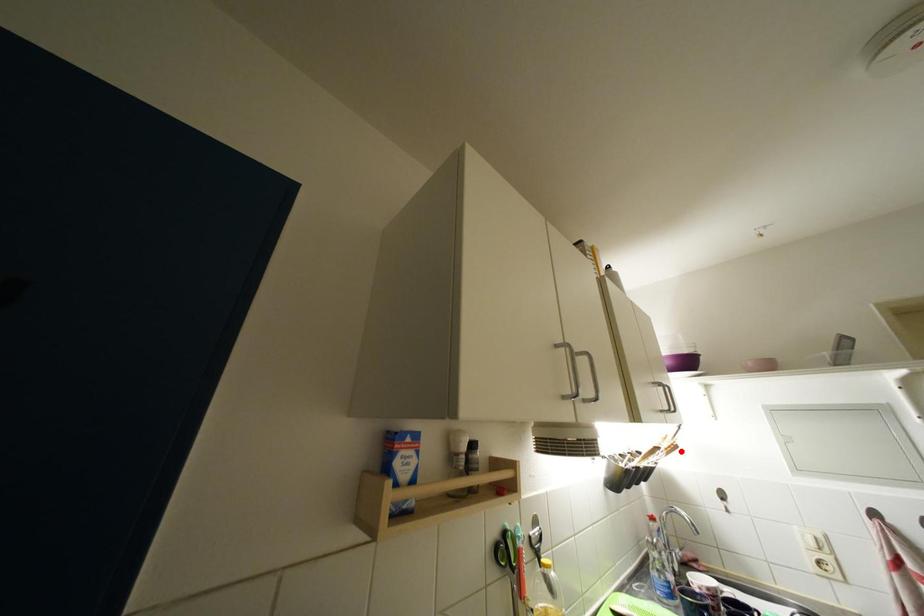
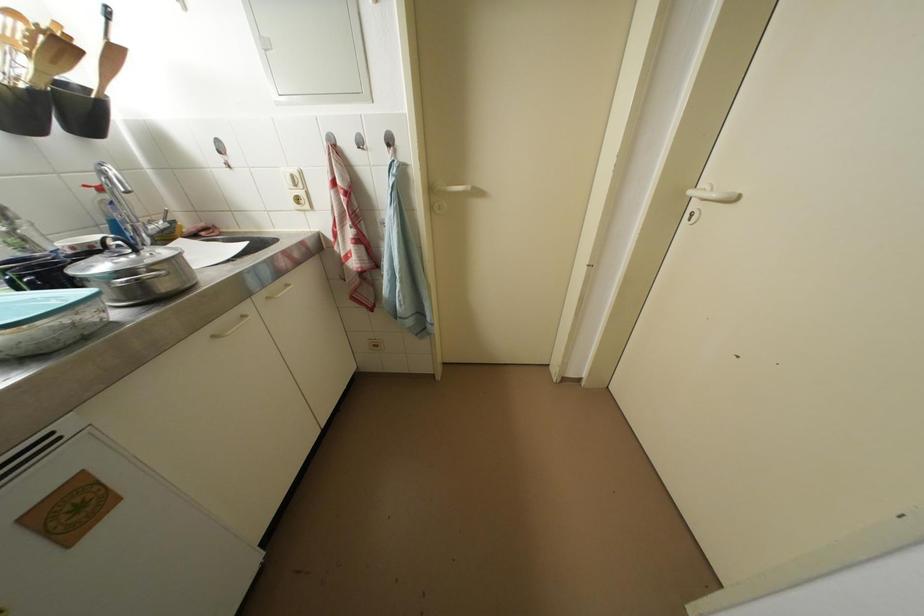
In the second image, find the point that corresponds to the highlighted location in the first image.

(69, 50)